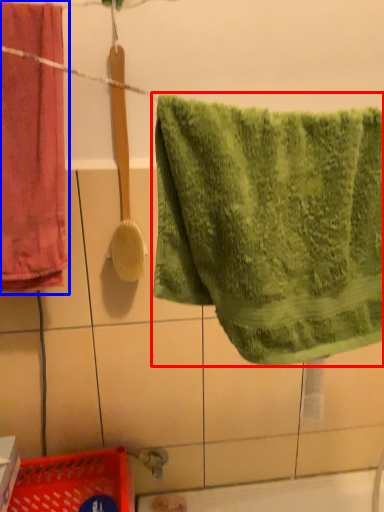
Question: Which object appears farthest to the camera in this image, towel (highlighted by a red box) or towel (highlighted by a blue box)?

Choices:
 (A) towel
 (B) towel

Answer: (B)